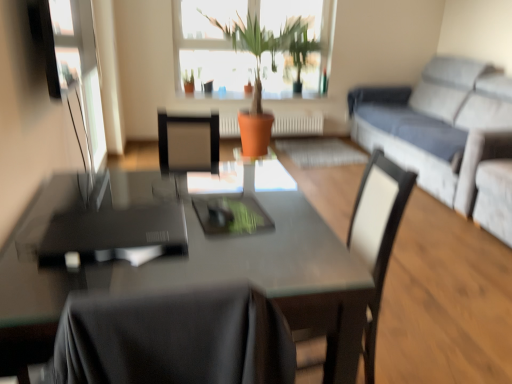
Question: From the image's perspective, does terracotta clay pot at center appear lower than light gray fabric couch at right?

Choices:
 (A) no
 (B) yes

Answer: (A)

Question: From a real-world perspective, does terracotta clay pot at center sit lower than light gray fabric couch at right?

Choices:
 (A) no
 (B) yes

Answer: (A)

Question: Does terracotta clay pot at center have a greater width compared to light gray fabric couch at right?

Choices:
 (A) no
 (B) yes

Answer: (B)

Question: From the image's perspective, is terracotta clay pot at center over light gray fabric couch at right?

Choices:
 (A) yes
 (B) no

Answer: (A)

Question: Can you confirm if terracotta clay pot at center is positioned to the left of light gray fabric couch at right?

Choices:
 (A) no
 (B) yes

Answer: (B)

Question: Is terracotta clay pot at center inside or outside of white leather chair at center?

Choices:
 (A) inside
 (B) outside

Answer: (B)

Question: Based on their sizes in the image, would you say terracotta clay pot at center is bigger or smaller than white leather chair at center?

Choices:
 (A) big
 (B) small

Answer: (A)

Question: In terms of height, does terracotta clay pot at center look taller or shorter compared to white leather chair at center?

Choices:
 (A) short
 (B) tall

Answer: (B)

Question: From the image's perspective, is terracotta clay pot at center located above or below white leather chair at center?

Choices:
 (A) above
 (B) below

Answer: (A)

Question: In terms of width, does light gray fabric couch at right look wider or thinner when compared to glossy glass table at center?

Choices:
 (A) thin
 (B) wide

Answer: (B)

Question: In the image, is light gray fabric couch at right positioned in front of or behind glossy glass table at center?

Choices:
 (A) front
 (B) behind

Answer: (B)

Question: From a real-world perspective, is light gray fabric couch at right positioned above or below glossy glass table at center?

Choices:
 (A) above
 (B) below

Answer: (A)

Question: Considering the positions of light gray fabric couch at right and glossy glass table at center in the image, is light gray fabric couch at right taller or shorter than glossy glass table at center?

Choices:
 (A) tall
 (B) short

Answer: (A)

Question: From the image's perspective, is terracotta clay pot at center above or below glossy glass table at center?

Choices:
 (A) below
 (B) above

Answer: (B)

Question: Is terracotta clay pot at center taller or shorter than glossy glass table at center?

Choices:
 (A) short
 (B) tall

Answer: (B)